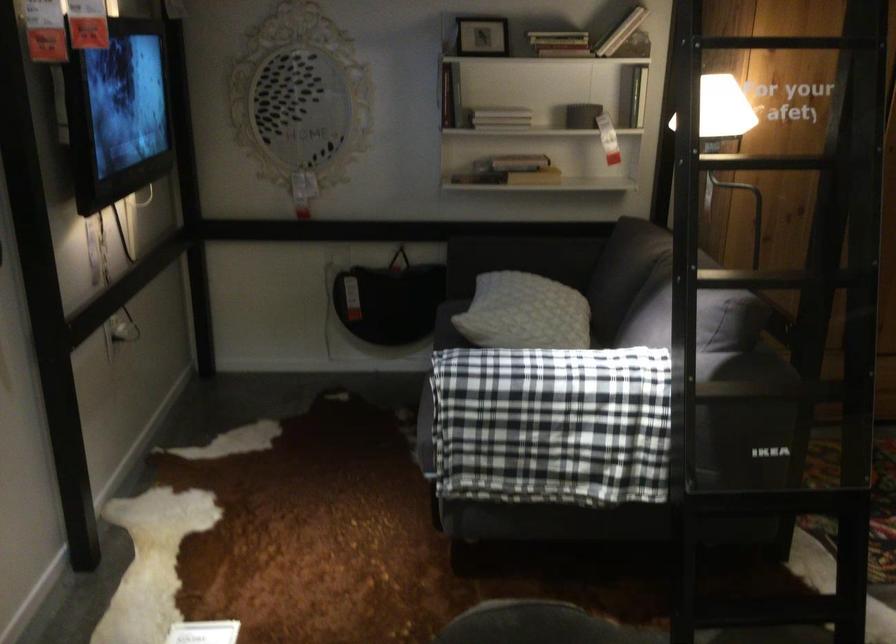
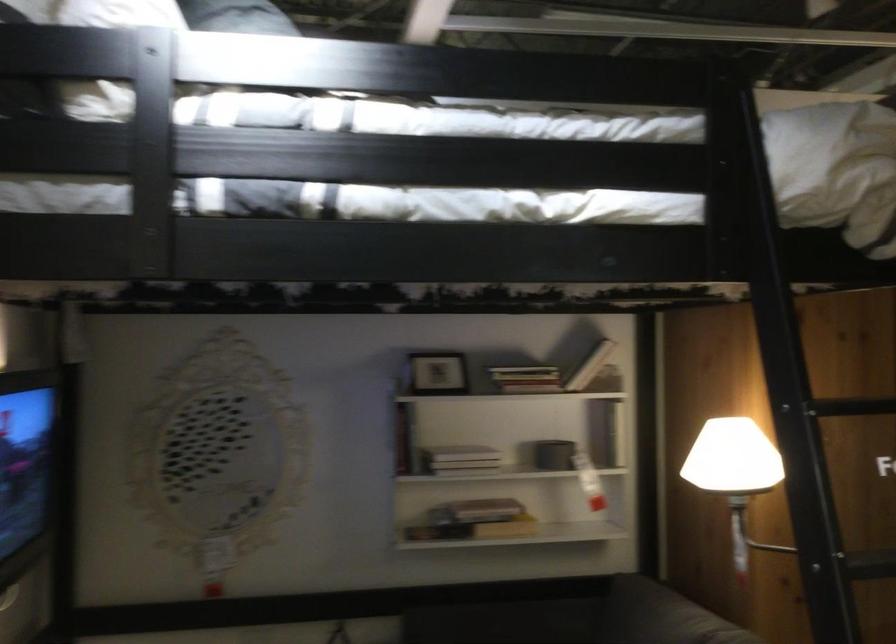
Find the pixel in the second image that matches point 497,102 in the first image.

(460, 453)